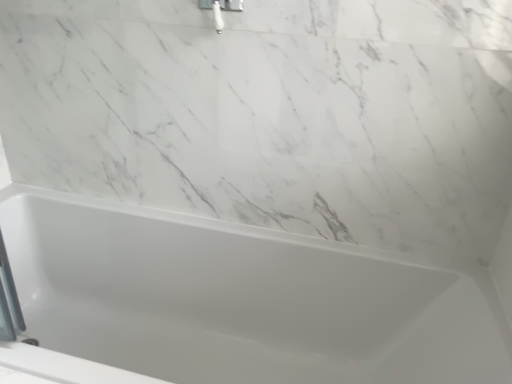
Measure the distance between point (388, 344) and camera.

Point (388, 344) and camera are 1.31 meters apart.

You are a GUI agent. You are given a task and a screenshot of the screen. Output one action in this format:
    pyautogui.click(x=<x>, y=<y>)
    Task: Click on the white glossy bathtub at center
    The width and height of the screenshot is (512, 384).
    Given the screenshot: What is the action you would take?
    pyautogui.click(x=241, y=300)

This screenshot has width=512, height=384. Describe the element at coordinates (241, 300) in the screenshot. I see `white glossy bathtub at center` at that location.

What do you see at coordinates (220, 9) in the screenshot?
I see `white glossy shower head at upper center` at bounding box center [220, 9].

You are a GUI agent. You are given a task and a screenshot of the screen. Output one action in this format:
    pyautogui.click(x=<x>, y=<y>)
    Task: Click on the white glossy shower head at upper center
    Image resolution: width=512 pixels, height=384 pixels.
    Given the screenshot: What is the action you would take?
    pyautogui.click(x=220, y=9)

Where is `white glossy bathtub at center`? white glossy bathtub at center is located at coordinates (241, 300).

Between white glossy bathtub at center and white glossy shower head at upper center, which one appears on the left side from the viewer's perspective?

white glossy bathtub at center is more to the left.

Which is behind, white glossy bathtub at center or white glossy shower head at upper center?

white glossy shower head at upper center.

Does point (494, 305) come behind point (202, 8)?

That is True.

From the image's perspective, is white glossy bathtub at center located above or below white glossy shower head at upper center?

From the image's perspective, white glossy bathtub at center appears below white glossy shower head at upper center.

From a real-world perspective, is white glossy bathtub at center positioned above or below white glossy shower head at upper center?

white glossy bathtub at center is below white glossy shower head at upper center.

Can you confirm if white glossy bathtub at center is wider than white glossy shower head at upper center?

Correct, the width of white glossy bathtub at center exceeds that of white glossy shower head at upper center.

Who is shorter, white glossy bathtub at center or white glossy shower head at upper center?

white glossy shower head at upper center.

Looking at the image, does white glossy bathtub at center seem bigger or smaller compared to white glossy shower head at upper center?

Clearly, white glossy bathtub at center is larger in size than white glossy shower head at upper center.

Is white glossy bathtub at center inside or outside of white glossy shower head at upper center?

white glossy bathtub at center is not enclosed by white glossy shower head at upper center.

Is the surface of white glossy bathtub at center in direct contact with white glossy shower head at upper center?

There is a gap between white glossy bathtub at center and white glossy shower head at upper center.

Could you tell me if white glossy bathtub at center is facing white glossy shower head at upper center?

No, white glossy bathtub at center is not turned towards white glossy shower head at upper center.

Identify the location of shower on the right side of white glossy bathtub at center. (220, 9).

Which object is positioned more to the left, white glossy shower head at upper center or white glossy bathtub at center?

white glossy bathtub at center.

Is white glossy shower head at upper center further to camera compared to white glossy bathtub at center?

Yes, white glossy shower head at upper center is further from the camera.

Which is behind, point (222, 23) or point (240, 236)?

Point (240, 236)

From the image's perspective, which one is positioned higher, white glossy shower head at upper center or white glossy bathtub at center?

white glossy shower head at upper center appears higher in the image.

From a real-world perspective, who is located lower, white glossy shower head at upper center or white glossy bathtub at center?

From a 3D spatial view, white glossy bathtub at center is below.

Considering the relative sizes of white glossy shower head at upper center and white glossy bathtub at center in the image provided, is white glossy shower head at upper center thinner than white glossy bathtub at center?

Yes, white glossy shower head at upper center is thinner than white glossy bathtub at center.

Who is taller, white glossy shower head at upper center or white glossy bathtub at center?

white glossy bathtub at center.

Looking at the image, does white glossy shower head at upper center seem bigger or smaller compared to white glossy bathtub at center?

white glossy shower head at upper center is smaller than white glossy bathtub at center.

Can white glossy bathtub at center be found inside white glossy shower head at upper center?

No.

Is white glossy shower head at upper center not near white glossy bathtub at center?

They are positioned close to each other.

Is white glossy shower head at upper center turned away from white glossy bathtub at center?

No, white glossy bathtub at center is not at the back of white glossy shower head at upper center.

Can you tell me how much white glossy shower head at upper center and white glossy bathtub at center differ in facing direction?

The angular difference between white glossy shower head at upper center and white glossy bathtub at center is 0.907 degrees.

How distant is white glossy shower head at upper center from white glossy bathtub at center?

white glossy shower head at upper center and white glossy bathtub at center are 36.11 inches apart.

Where is `shower that appears above the white glossy bathtub at center (from a real-world perspective)`? shower that appears above the white glossy bathtub at center (from a real-world perspective) is located at coordinates (220, 9).

Locate an element on the screen. bathtub below the white glossy shower head at upper center (from a real-world perspective) is located at coordinates (241, 300).

The image size is (512, 384). Find the location of `bathtub below the white glossy shower head at upper center (from the image's perspective)`. bathtub below the white glossy shower head at upper center (from the image's perspective) is located at coordinates (241, 300).